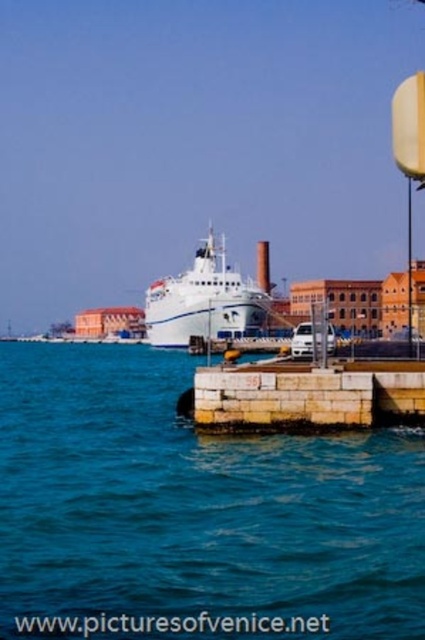
You are a photographer planning to capture the white glossy cruise ship at center and the blue water at center in a single shot. Based on their sizes in the image, which one will occupy more of the frame?

The white glossy cruise ship at center is larger than the blue water at center, so it will occupy more of the frame.

You are a photographer planning to capture the white glossy cruise ship at center and the blue water at center in a single shot. Based on the scene, which object will occupy more horizontal space in the photo?

The blue water at center has a greater width than the white glossy cruise ship at center, so it will occupy more horizontal space in the photo.